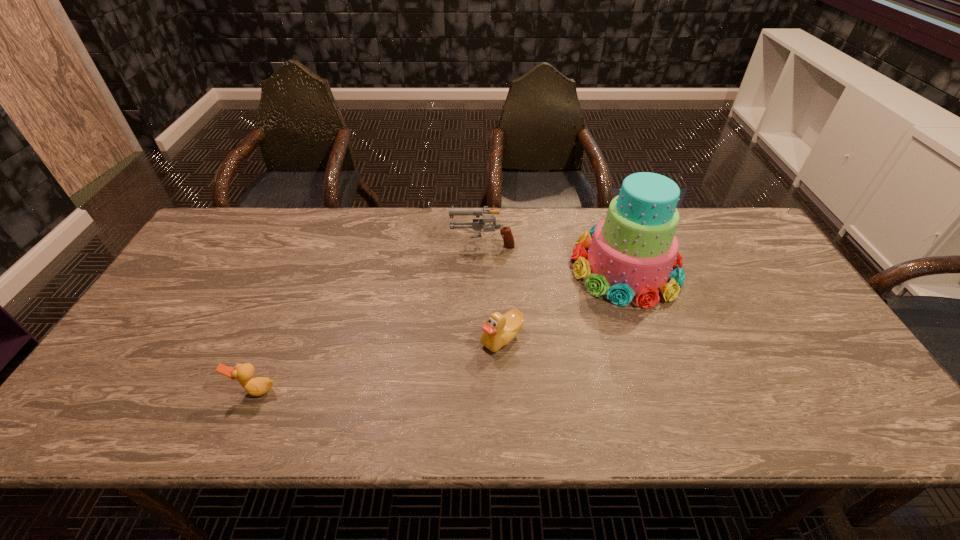
You are a GUI agent. You are given a task and a screenshot of the screen. Output one action in this format:
    pyautogui.click(x=<x>, y=<y>)
    Task: Click on the vacant space that is in between the rightmost object and the right duck
    Image resolution: width=960 pixels, height=540 pixels.
    Given the screenshot: What is the action you would take?
    pyautogui.click(x=564, y=302)

The image size is (960, 540). What are the coordinates of `object that stands as the second closest to the tallest object` in the screenshot? It's located at (499, 330).

Locate an element on the screen. This screenshot has width=960, height=540. the third closest object to the gun is located at coordinates (258, 386).

Where is `vacant area that satisfies the following two spatial constraints: 1. at the beak of the second nearest object; 2. on the beak of the leftmost object`? This screenshot has height=540, width=960. vacant area that satisfies the following two spatial constraints: 1. at the beak of the second nearest object; 2. on the beak of the leftmost object is located at coordinates (504, 390).

The image size is (960, 540). Identify the location of vacant point that satisfies the following two spatial constraints: 1. at the barrel end of the third shortest object; 2. on the right side of the cake. (483, 267).

This screenshot has width=960, height=540. What are the coordinates of `vacant region that satisfies the following two spatial constraints: 1. at the barrel end of the tallest object; 2. on the right side of the gun` in the screenshot? It's located at [x=483, y=267].

Find the location of a particular element. vacant area that satisfies the following two spatial constraints: 1. on the back side of the rightmost object; 2. at the barrel end of the gun is located at coordinates (616, 243).

In order to click on free location that satisfies the following two spatial constraints: 1. at the barrel end of the gun; 2. on the beak of the nearest object in this screenshot , I will do `click(484, 390)`.

Where is `vacant space that satisfies the following two spatial constraints: 1. at the barrel end of the tallest object; 2. on the left side of the gun`? This screenshot has height=540, width=960. vacant space that satisfies the following two spatial constraints: 1. at the barrel end of the tallest object; 2. on the left side of the gun is located at coordinates (483, 267).

In order to click on vacant position in the image that satisfies the following two spatial constraints: 1. at the beak of the farther duck; 2. on the beak of the nearer duck in this screenshot , I will do `click(504, 390)`.